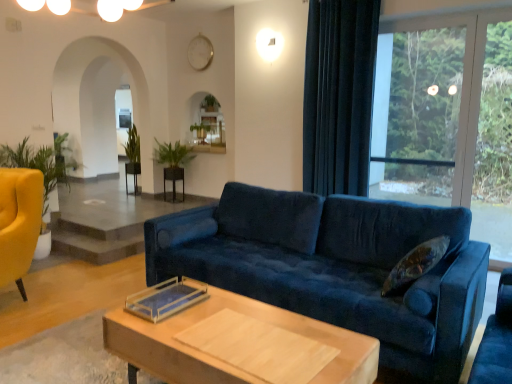
Question: Is green leafy plant at center, which ranks as the first plant in left-to-right order, surrounded by transparent glass window at upper right?

Choices:
 (A) no
 (B) yes

Answer: (A)

Question: Considering the relative positions of transparent glass window at upper right and green leafy plant at center, arranged as the first plant when viewed from the back, in the image provided, is transparent glass window at upper right to the left of green leafy plant at center, arranged as the first plant when viewed from the back, from the viewer's perspective?

Choices:
 (A) no
 (B) yes

Answer: (A)

Question: Is transparent glass window at upper right shorter than green leafy plant at center, the second plant viewed from the right?

Choices:
 (A) yes
 (B) no

Answer: (B)

Question: Can you confirm if transparent glass window at upper right is taller than green leafy plant at center, the second plant viewed from the right?

Choices:
 (A) yes
 (B) no

Answer: (A)

Question: Is transparent glass window at upper right aimed at green leafy plant at center, the second plant viewed from the right?

Choices:
 (A) no
 (B) yes

Answer: (A)

Question: From a real-world perspective, is transparent glass window at upper right positioned above or below black wood side table at center, the 2th side table when ordered from back to front?

Choices:
 (A) above
 (B) below

Answer: (A)

Question: Is transparent glass window at upper right wider or thinner than black wood side table at center, the 2th side table when ordered from back to front?

Choices:
 (A) wide
 (B) thin

Answer: (B)

Question: Based on their sizes in the image, would you say transparent glass window at upper right is bigger or smaller than black wood side table at center, the 1th side table from the front?

Choices:
 (A) big
 (B) small

Answer: (A)

Question: From their relative heights in the image, would you say transparent glass window at upper right is taller or shorter than black wood side table at center, which is counted as the 2th side table, starting from the left?

Choices:
 (A) tall
 (B) short

Answer: (A)

Question: In the image, is matte yellow armchair at left on the left side or the right side of velvet blue couch at center?

Choices:
 (A) right
 (B) left

Answer: (B)

Question: Considering the positions of point (22, 168) and point (419, 208), is point (22, 168) closer or farther from the camera than point (419, 208)?

Choices:
 (A) farther
 (B) closer

Answer: (A)

Question: Is matte yellow armchair at left spatially inside velvet blue couch at center, or outside of it?

Choices:
 (A) outside
 (B) inside

Answer: (A)

Question: From a real-world perspective, is matte yellow armchair at left above or below velvet blue couch at center?

Choices:
 (A) below
 (B) above

Answer: (B)

Question: Would you say black glossy side table at center, the 1th side table in the back-to-front sequence, is to the left or to the right of velvet dark blue curtain at right in the picture?

Choices:
 (A) left
 (B) right

Answer: (A)

Question: Would you say black glossy side table at center, which is the second side table from right to left, is inside or outside velvet dark blue curtain at right?

Choices:
 (A) outside
 (B) inside

Answer: (A)